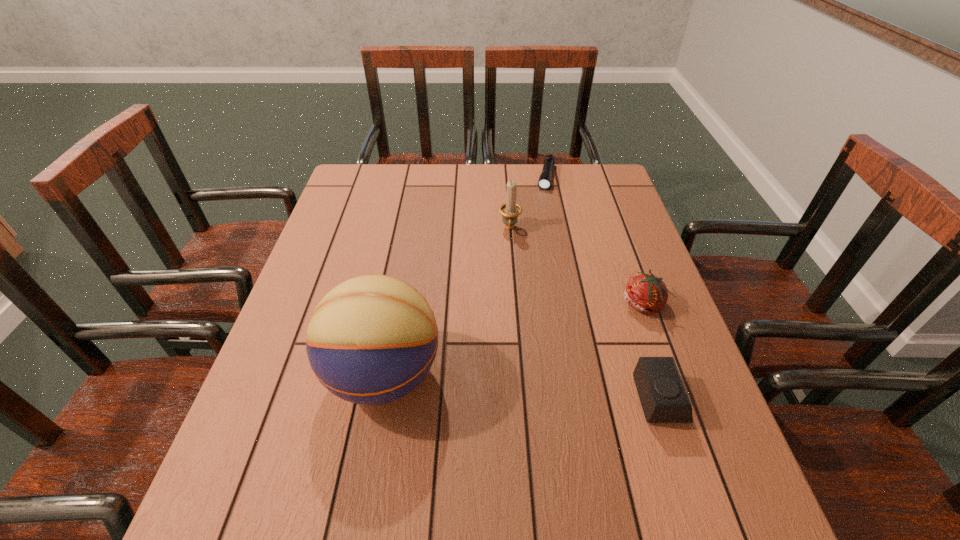
Identify the location of free region at the near left corner. (280, 467).

What are the coordinates of `free space between the candle_holder and the farthest object` in the screenshot? It's located at (528, 203).

I want to click on vacant space that's between the basketball and the alarm clock, so click(522, 387).

The width and height of the screenshot is (960, 540). What are the coordinates of `blank region between the leftmost object and the alarm clock` in the screenshot? It's located at (522, 387).

At what (x,y) coordinates should I click in order to perform the action: click on free area in between the tallest object and the fourth shortest object. Please return your answer as a coordinate pair (x, y). The image size is (960, 540). Looking at the image, I should click on click(x=446, y=302).

Where is `free spot between the second object from left to right and the basketball`? free spot between the second object from left to right and the basketball is located at coordinates (446, 302).

Identify the location of free space between the fourth nearest object and the basketball. This screenshot has height=540, width=960. (446, 302).

This screenshot has height=540, width=960. I want to click on empty space between the alarm clock and the leftmost object, so click(522, 387).

Identify the location of empty space that is in between the farthest object and the leftmost object. The image size is (960, 540). (465, 276).

Find the location of a particular element. This screenshot has width=960, height=540. vacant region between the tomato and the alarm clock is located at coordinates (652, 352).